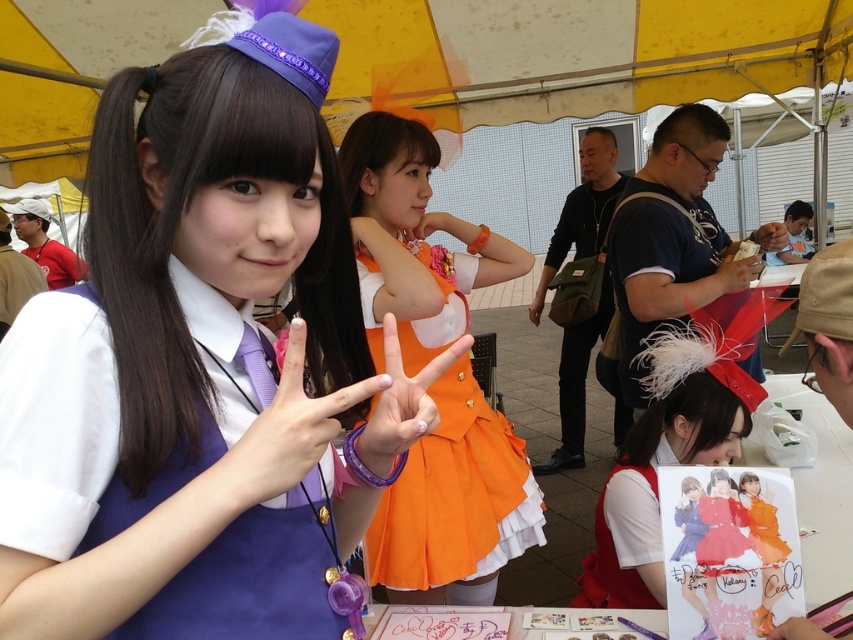
How distant is matte orange dress at center from matte black hand at center?

26.56 inches

Does matte orange dress at center have a larger size compared to matte black hand at center?

Indeed, matte orange dress at center has a larger size compared to matte black hand at center.

Does point (763, 397) come closer to viewer compared to point (735, 268)?

Yes.

The image size is (853, 640). Identify the location of matte orange dress at center. (666, 456).

Does matte purple dress at center lie in front of matte orange hand at center?

Yes, it is in front of matte orange hand at center.

How distant is matte purple dress at center from matte orange hand at center?

matte purple dress at center is 3.50 meters away from matte orange hand at center.

Find the location of a particular element. matte purple dress at center is located at coordinates (199, 368).

Does matte purple dress at center have a greater width compared to orange fabric hand at upper center?

Yes, matte purple dress at center is wider than orange fabric hand at upper center.

The image size is (853, 640). Describe the element at coordinates (199, 368) in the screenshot. I see `matte purple dress at center` at that location.

Who is more distant from viewer, (112, 76) or (445, 228)?

Point (445, 228)

Image resolution: width=853 pixels, height=640 pixels. Find the location of `matte purple dress at center`. matte purple dress at center is located at coordinates (199, 368).